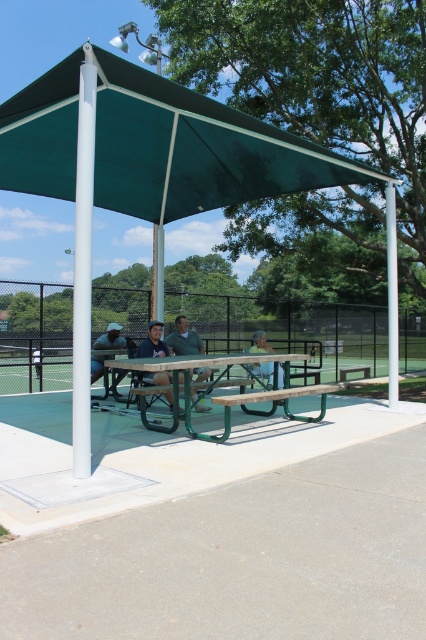
Describe the element at coordinates (259, 342) in the screenshot. Image resolution: width=426 pixels, height=640 pixels. I see `light blue fabric at center` at that location.

Does point (282, 380) lie in front of point (39, 372)?

Yes, point (282, 380) is closer to viewer.

Where is `light blue fabric at center`? Image resolution: width=426 pixels, height=640 pixels. light blue fabric at center is located at coordinates (259, 342).

Between point (166, 339) and point (249, 352), which one is positioned in front?

Point (166, 339)

Does green plastic picnic table at center appear on the right side of light blue fabric at center?

Incorrect, green plastic picnic table at center is not on the right side of light blue fabric at center.

At what (x,y) coordinates should I click in order to perform the action: click on green plastic picnic table at center. Please return your answer as a coordinate pair (x, y). This screenshot has width=426, height=640. Looking at the image, I should click on (184, 339).

At what (x,y) coordinates should I click in order to perform the action: click on green plastic picnic table at center. Please return your answer as a coordinate pair (x, y). The image size is (426, 640). Looking at the image, I should click on (184, 339).

Which is above, green wood picnic table at center or green fabric umbrella at upper left?

green fabric umbrella at upper left is higher up.

Is green wood picnic table at center thinner than green fabric umbrella at upper left?

Incorrect, green wood picnic table at center's width is not less than green fabric umbrella at upper left's.

This screenshot has width=426, height=640. What are the coordinates of `green wood picnic table at center` in the screenshot? It's located at [x=221, y=396].